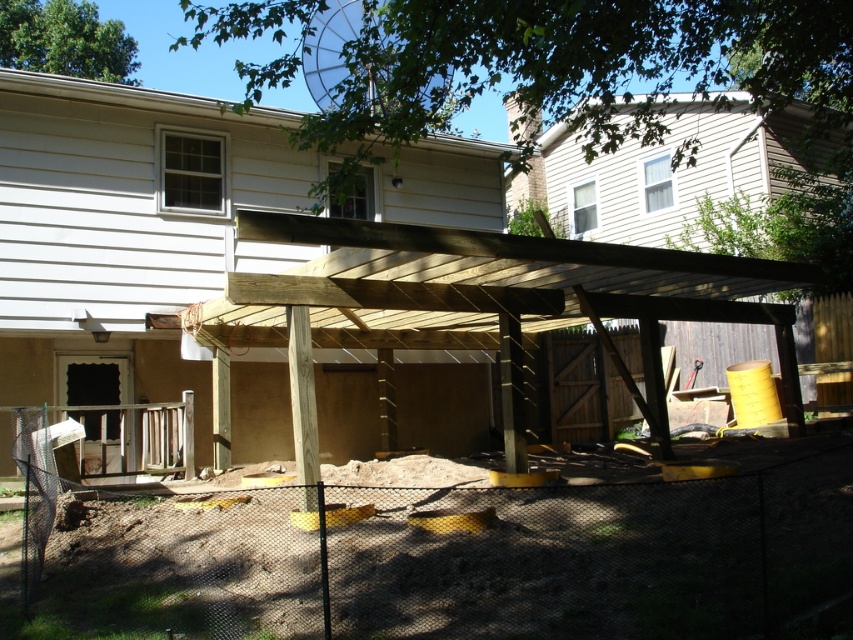
Does point (260, 458) lie behind point (137, 417)?

Yes, it is.

Is wooden pergola at center in front of wooden fence at lower left?

Yes, it is in front of wooden fence at lower left.

Where is `wooden pergola at center`? This screenshot has height=640, width=853. wooden pergola at center is located at coordinates (126, 234).

Locate an element on the screen. black mesh fence at lower center is located at coordinates (445, 554).

Is black mesh fence at lower center to the right of wooden pergola at center from the viewer's perspective?

In fact, black mesh fence at lower center is to the left of wooden pergola at center.

Measure the distance between black mesh fence at lower center and camera.

The distance of black mesh fence at lower center from camera is 9.10 meters.

The height and width of the screenshot is (640, 853). In order to click on black mesh fence at lower center in this screenshot , I will do `click(445, 554)`.

Which is more to the left, black mesh fence at lower center or wooden fence at lower left?

Positioned to the left is wooden fence at lower left.

Is black mesh fence at lower center above wooden fence at lower left?

No, black mesh fence at lower center is not above wooden fence at lower left.

Does point (837, 573) lie behind point (56, 408)?

No, (837, 573) is in front of (56, 408).

Identify the location of black mesh fence at lower center. The width and height of the screenshot is (853, 640). (445, 554).